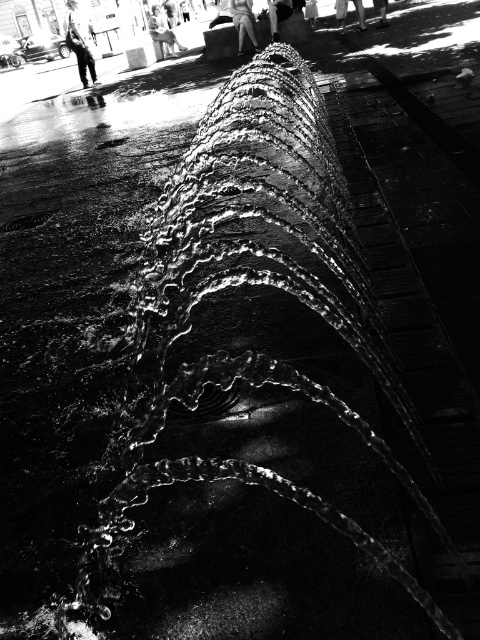
You are a photographer trying to capture the fountain in the image. You notice a person wearing a white cotton dress at center and another wearing skinny jeans at lower right. Which clothing item would likely appear more prominent in your photo due to its size?

The white cotton dress at center would appear more prominent in the photo because it is bigger than the skinny jeans at lower right.

From the picture: You are standing in front of the fountain and notice two points marked in the image. The first point is at coordinates point (237, 8) and the second is at point (384, 1). Which of these points is closer to you?

Point (384, 1) is closer to you because it is less further to the camera than point (237, 8).